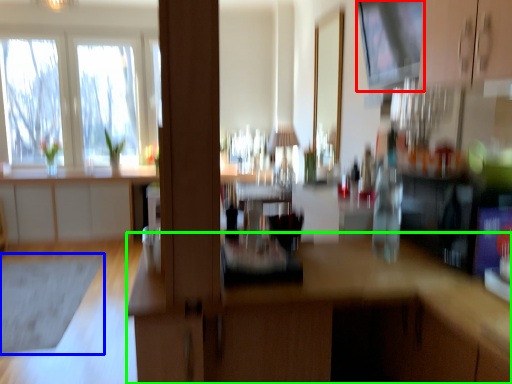
Question: Estimate the real-world distances between objects in this image. Which object is closer to window screen (highlighted by a red box), mat (highlighted by a blue box) or computer desk (highlighted by a green box)?

Choices:
 (A) mat
 (B) computer desk

Answer: (B)